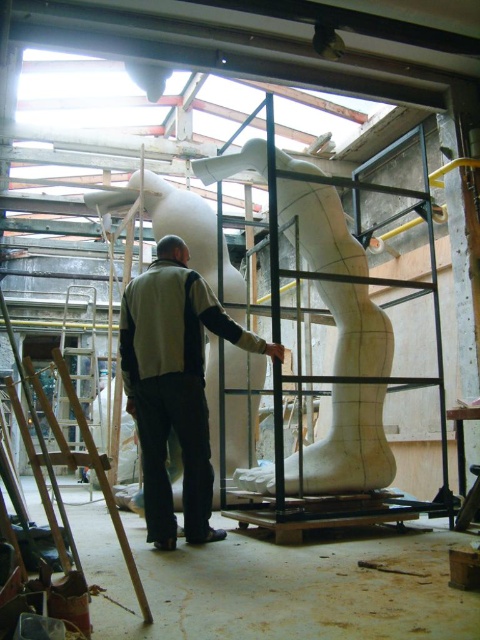
Question: Does light gray fabric jacket at center have a larger size compared to metallic silver ladder at left?

Choices:
 (A) no
 (B) yes

Answer: (A)

Question: Is white marble sculpture at center in front of metallic silver ladder at left?

Choices:
 (A) yes
 (B) no

Answer: (A)

Question: Which is farther from the metallic silver ladder at left?

Choices:
 (A) white marble sculpture at center
 (B) light gray fabric jacket at center

Answer: (B)

Question: Can you confirm if white marble sculpture at center is thinner than metallic silver ladder at left?

Choices:
 (A) yes
 (B) no

Answer: (B)

Question: Which point is closer to the camera?

Choices:
 (A) (80, 448)
 (B) (311, 208)

Answer: (B)

Question: Which of the following is the closest to the observer?

Choices:
 (A) (370, 420)
 (B) (205, 499)

Answer: (B)